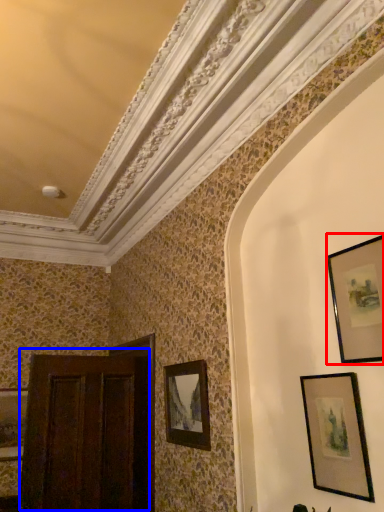
Question: Among these objects, which one is nearest to the camera, picture frame (highlighted by a red box) or door (highlighted by a blue box)?

Choices:
 (A) picture frame
 (B) door

Answer: (A)